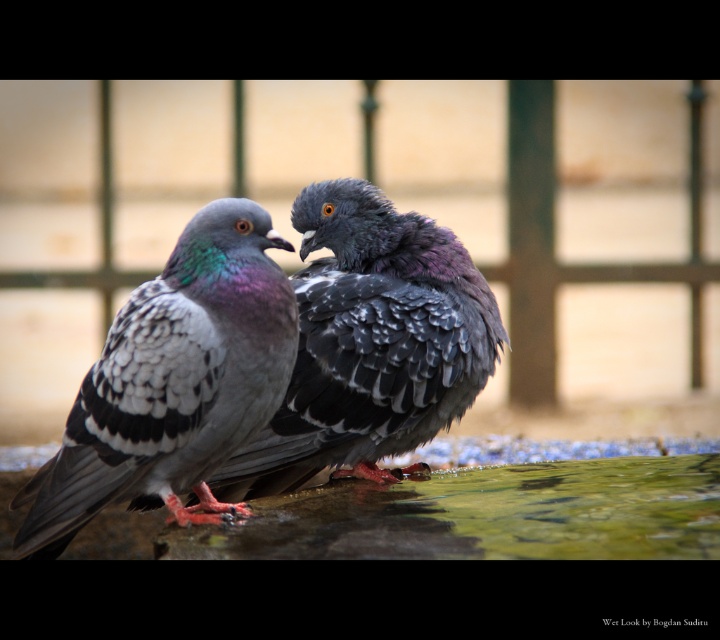
You are a photographer who wants to focus on the speckled feathered pigeon at left. Based on the coordinates given, where should you adjust your camera focus to capture this pigeon clearly?

The speckled feathered pigeon at left is located at coordinates point [174,381], so adjust the camera focus to that point to capture it clearly.

You are a photographer who wants to capture a closeup of the speckled feathered pigeon at left. Given that the point at coordinates point (174, 381) is the center of your camera frame, will the pigeon be fully inside the frame?

The point (174, 381) corresponds to the speckled feathered pigeon at left, so yes, the pigeon will be fully inside the frame since the point is the center of the frame.

You are a birdwatcher observing two pigeons in the image. The scene has a speckled feathered pigeon at left and a shiny gray feathers at center. Which pigeon is positioned more to the left side?

The speckled feathered pigeon at left is positioned more to the left side.